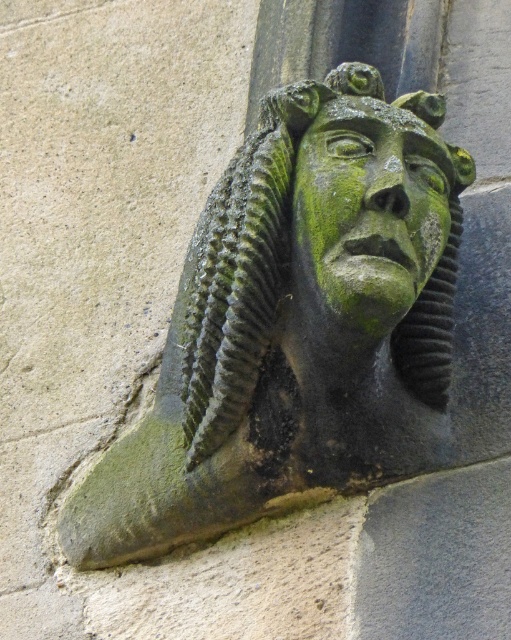
Question: From the image, what is the correct spatial relationship of green stone head at center in relation to green stone face at center?

Choices:
 (A) above
 (B) below

Answer: (B)

Question: Among these objects, which one is farthest from the camera?

Choices:
 (A) green stone head at center
 (B) green stone face at center

Answer: (B)

Question: Does green stone head at center appear on the right side of green stone face at center?

Choices:
 (A) yes
 (B) no

Answer: (B)

Question: Which object appears farthest from the camera in this image?

Choices:
 (A) green stone face at center
 (B) green stone head at center

Answer: (A)

Question: Is green stone head at center above green stone face at center?

Choices:
 (A) yes
 (B) no

Answer: (B)